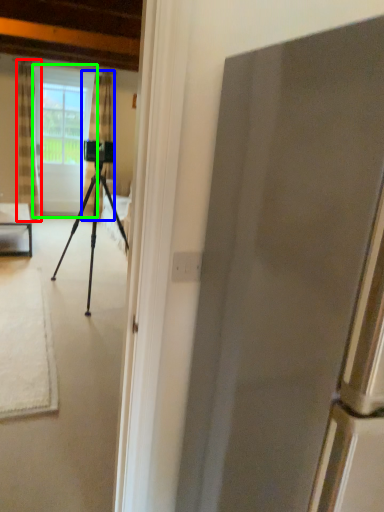
Question: Based on their relative distances, which object is farther from curtain (highlighted by a red box)? Choose from curtain (highlighted by a blue box) and screen door (highlighted by a green box).

Choices:
 (A) curtain
 (B) screen door

Answer: (A)